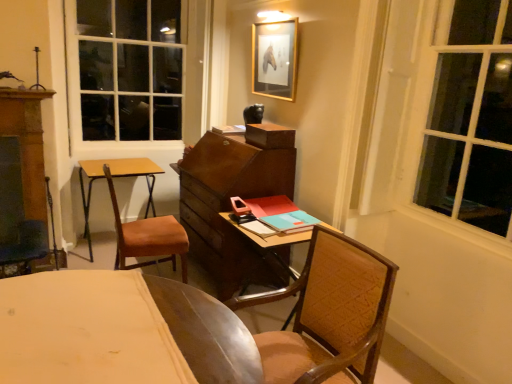
Question: Can you confirm if gold-framed picture at upper center is shorter than brown woven chair at center, which appears as the first chair when viewed from the front?

Choices:
 (A) yes
 (B) no

Answer: (A)

Question: Considering the relative positions of gold-framed picture at upper center and brown woven chair at center, which is counted as the 1th chair, starting from the right, in the image provided, is gold-framed picture at upper center to the right of brown woven chair at center, which is counted as the 1th chair, starting from the right, from the viewer's perspective?

Choices:
 (A) no
 (B) yes

Answer: (A)

Question: Can you confirm if gold-framed picture at upper center is wider than brown woven chair at center, which appears as the 2th chair when viewed from the back?

Choices:
 (A) yes
 (B) no

Answer: (B)

Question: Is the depth of gold-framed picture at upper center less than that of brown woven chair at center, which is counted as the 1th chair, starting from the right?

Choices:
 (A) no
 (B) yes

Answer: (A)

Question: Does gold-framed picture at upper center contain brown woven chair at center, which appears as the 2th chair when viewed from the back?

Choices:
 (A) no
 (B) yes

Answer: (A)

Question: From a real-world perspective, is wooden desk at center physically located above or below brown woven chair at center, which is counted as the 1th chair, starting from the right?

Choices:
 (A) below
 (B) above

Answer: (A)

Question: Visually, is wooden desk at center positioned to the left or to the right of brown woven chair at center, which appears as the 2th chair when viewed from the back?

Choices:
 (A) right
 (B) left

Answer: (A)

Question: Looking at the image, does wooden desk at center seem bigger or smaller compared to brown woven chair at center, which appears as the first chair when viewed from the front?

Choices:
 (A) small
 (B) big

Answer: (A)

Question: Is point (229, 218) positioned closer to the camera than point (352, 296)?

Choices:
 (A) farther
 (B) closer

Answer: (A)

Question: From the image's perspective, is brown woven chair at center, which is counted as the 1th chair, starting from the right, above or below wooden desk at center?

Choices:
 (A) below
 (B) above

Answer: (A)

Question: From a real-world perspective, is brown woven chair at center, which appears as the 2th chair when viewed from the back, above or below wooden desk at center?

Choices:
 (A) below
 (B) above

Answer: (B)

Question: In terms of size, does brown woven chair at center, marked as the second chair in a left-to-right arrangement, appear bigger or smaller than wooden desk at center?

Choices:
 (A) small
 (B) big

Answer: (B)

Question: In terms of height, does brown woven chair at center, which appears as the first chair when viewed from the front, look taller or shorter compared to wooden desk at center?

Choices:
 (A) tall
 (B) short

Answer: (A)

Question: Considering the positions of brown leather chair at left, the second chair in the right-to-left sequence, and brown woven chair at center, which appears as the first chair when viewed from the front, in the image, is brown leather chair at left, the second chair in the right-to-left sequence, wider or thinner than brown woven chair at center, which appears as the first chair when viewed from the front,?

Choices:
 (A) wide
 (B) thin

Answer: (B)

Question: From the image's perspective, is brown leather chair at left, which appears as the 1th chair when viewed from the back, located above or below brown woven chair at center, which appears as the 2th chair when viewed from the back?

Choices:
 (A) below
 (B) above

Answer: (B)